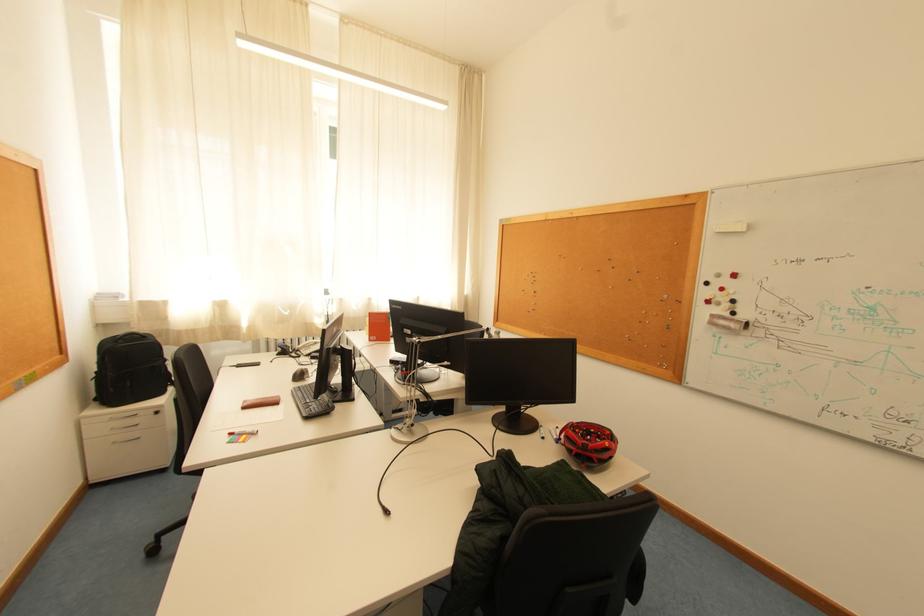
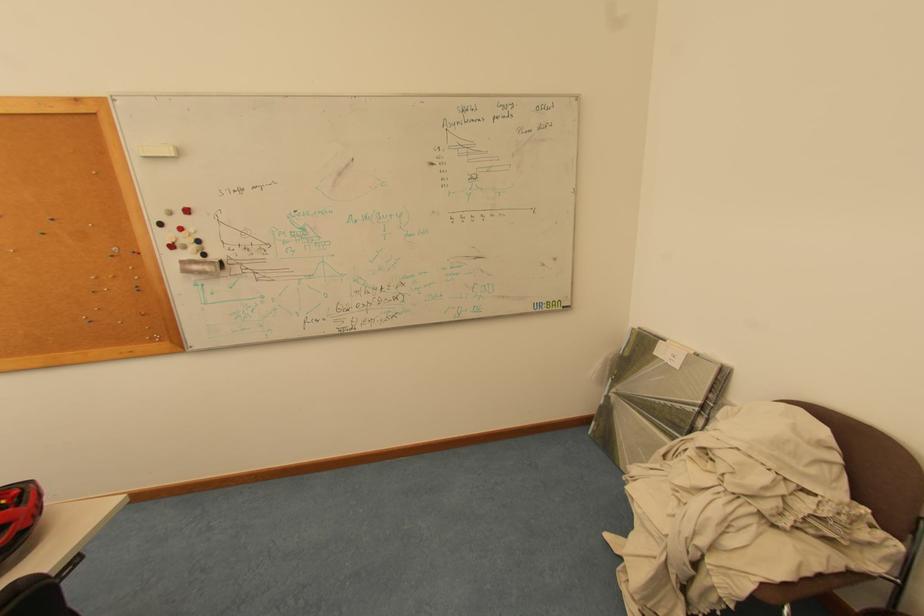
In the second image, find the point that corresponds to point (617, 434) in the first image.

(25, 493)